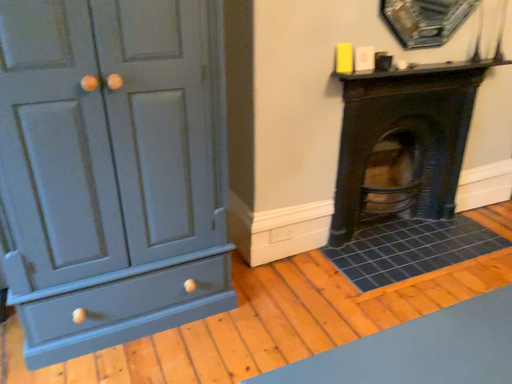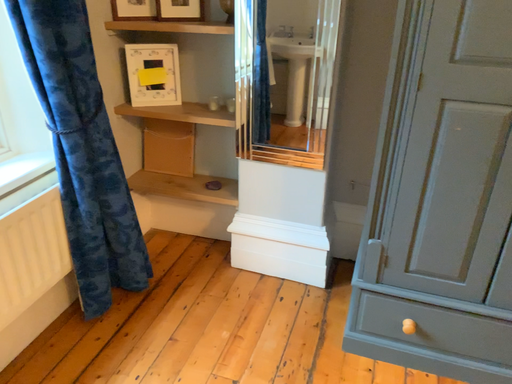
Question: Which way did the camera rotate in the video?

Choices:
 (A) rotated left
 (B) rotated right

Answer: (A)